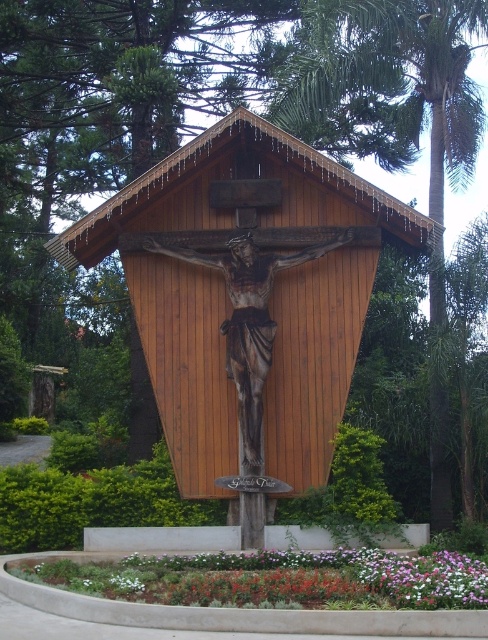
Is wooden crucifix at center wider than green leafy palm tree at center?

Indeed, wooden crucifix at center has a greater width compared to green leafy palm tree at center.

Is point (191, 337) positioned before point (326, 64)?

Yes, point (191, 337) is in front of point (326, 64).

Identify the location of wooden crucifix at center. The image size is (488, 640). (226, 289).

Between green leafy palm tree at center and white matte flower at lower center, which one appears on the left side from the viewer's perspective?

Positioned to the left is white matte flower at lower center.

Does green leafy palm tree at center appear over white matte flower at lower center?

Yes, green leafy palm tree at center is above white matte flower at lower center.

Does point (441, 60) lie behind point (122, 572)?

Yes, it is behind point (122, 572).

You are a GUI agent. You are given a task and a screenshot of the screen. Output one action in this format:
    pyautogui.click(x=<x>, y=<y>)
    Task: Click on the green leafy palm tree at center
    This screenshot has width=488, height=640.
    Given the screenshot: What is the action you would take?
    pyautogui.click(x=400, y=125)

Who is positioned more to the right, green leafy palm tree at center or multicolored petals at lower center?

green leafy palm tree at center is more to the right.

Is green leafy palm tree at center below multicolored petals at lower center?

No.

Image resolution: width=488 pixels, height=640 pixels. I want to click on green leafy palm tree at center, so pos(400,125).